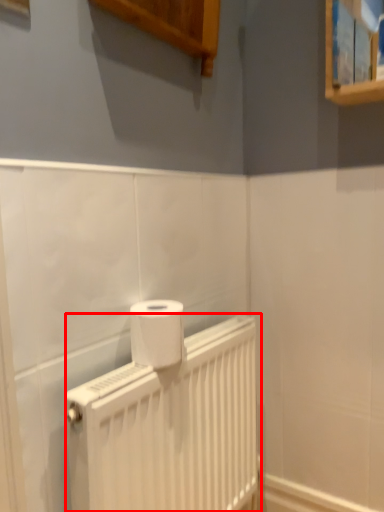
Question: From the image, what is the correct spatial relationship of radiator (annotated by the red box) in relation to toilet paper?

Choices:
 (A) right
 (B) left

Answer: (A)